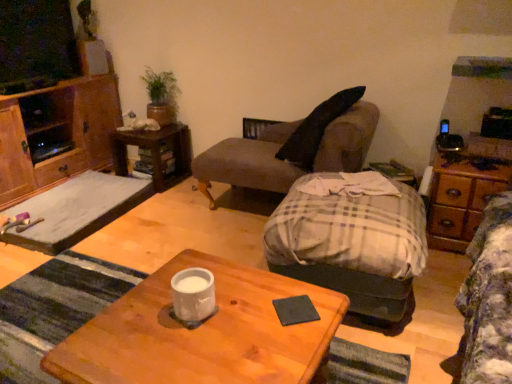
Question: Based on their positions, is brown wood side table at upper left, the first side table in the left-to-right sequence, located to the left or right of wooden desk at center?

Choices:
 (A) left
 (B) right

Answer: (A)

Question: Considering the positions of brown wood side table at upper left, positioned as the 2th side table in right-to-left order, and wooden desk at center in the image, is brown wood side table at upper left, positioned as the 2th side table in right-to-left order, taller or shorter than wooden desk at center?

Choices:
 (A) tall
 (B) short

Answer: (B)

Question: Which object is positioned closest to the plaid fabric ottoman at center, placed as the first studio couch when sorted from front to back?

Choices:
 (A) wooden side table at center, the first side table from the front
 (B) gray fabric couch at center, positioned as the 2th studio couch in front-to-back order
 (C) wooden desk at center
 (D) smooth gray mat at left
 (E) brown wood side table at upper left, which is the first side table in back-to-front order

Answer: (C)

Question: Estimate the real-world distances between objects in this image. Which object is farther from the green matte plant at upper left?

Choices:
 (A) wooden side table at center, positioned as the 2th side table in back-to-front order
 (B) wooden dresser at right
 (C) plaid fabric ottoman at center, the second studio couch positioned from the back
 (D) brown wood side table at upper left, the first side table in the left-to-right sequence
 (E) black matte coaster at center

Answer: (E)